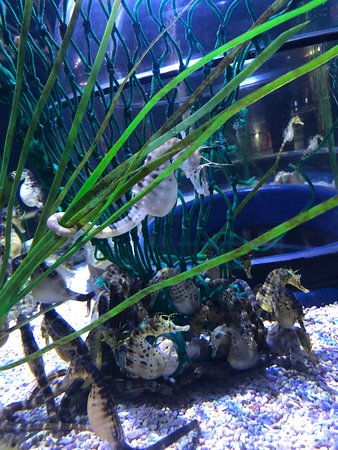
Find the location of a particular element. The image size is (338, 450). blue bowl is located at coordinates click(x=317, y=253).